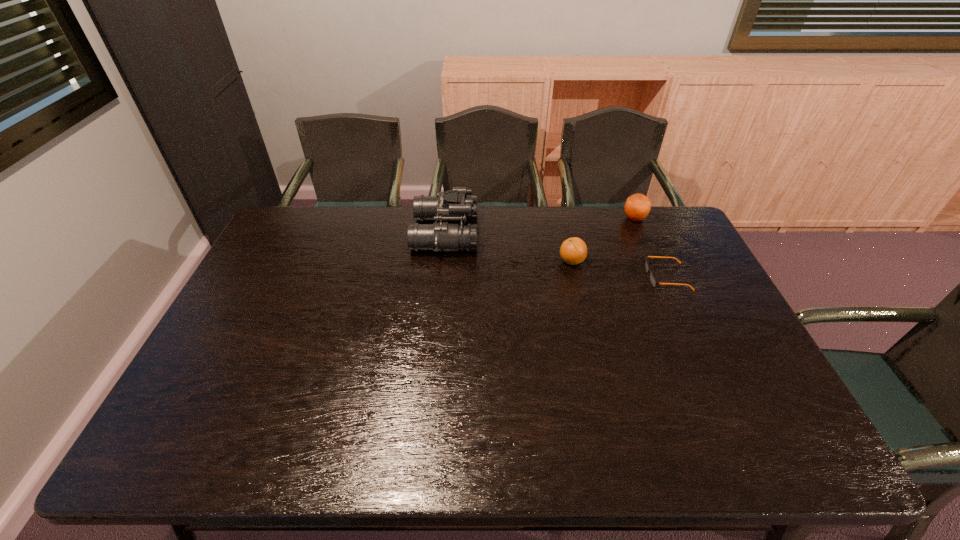
The image size is (960, 540). I want to click on vacant area at the right edge of the desktop, so click(x=697, y=354).

In the image, there is a desktop. Where is `vacant space at the near right corner`? The width and height of the screenshot is (960, 540). vacant space at the near right corner is located at coordinates (798, 455).

This screenshot has height=540, width=960. What are the coordinates of `empty space between the third object from right to left and the shortest object` in the screenshot? It's located at (619, 269).

Identify the location of empty space that is in between the leftmost object and the shortest object. The width and height of the screenshot is (960, 540). (556, 255).

Identify the location of empty space between the right orange and the shortest object. The width and height of the screenshot is (960, 540). (651, 248).

I want to click on free space that is in between the leftmost object and the spectacles, so click(x=556, y=255).

You are a GUI agent. You are given a task and a screenshot of the screen. Output one action in this format:
    pyautogui.click(x=<x>, y=<y>)
    Task: Click on the free space between the third tallest object and the binoculars
    The height and width of the screenshot is (540, 960).
    Given the screenshot: What is the action you would take?
    pyautogui.click(x=509, y=247)

What are the coordinates of `free space that is in between the right orange and the binoculars` in the screenshot? It's located at (540, 226).

Find the location of a particular element. This screenshot has height=540, width=960. free space that is in between the farther orange and the spectacles is located at coordinates (651, 248).

Find the location of a particular element. free space between the spectacles and the left orange is located at coordinates (619, 269).